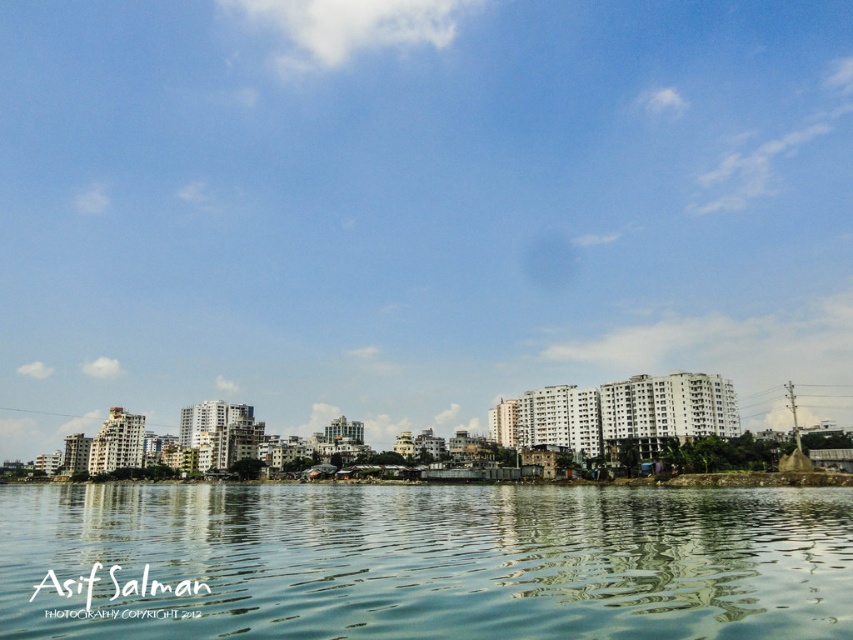
Question: Is blue sky at upper center smaller than clear water at center?

Choices:
 (A) yes
 (B) no

Answer: (B)

Question: Does blue sky at upper center appear on the right side of clear water at center?

Choices:
 (A) no
 (B) yes

Answer: (A)

Question: Is the position of blue sky at upper center less distant than that of clear water at center?

Choices:
 (A) no
 (B) yes

Answer: (A)

Question: Which object appears farthest from the camera in this image?

Choices:
 (A) blue sky at upper center
 (B) clear water at center

Answer: (A)

Question: Which object appears farthest from the camera in this image?

Choices:
 (A) clear water at center
 (B) blue sky at upper center

Answer: (B)

Question: Which of the following is the closest to the observer?

Choices:
 (A) clear water at center
 (B) blue sky at upper center

Answer: (A)